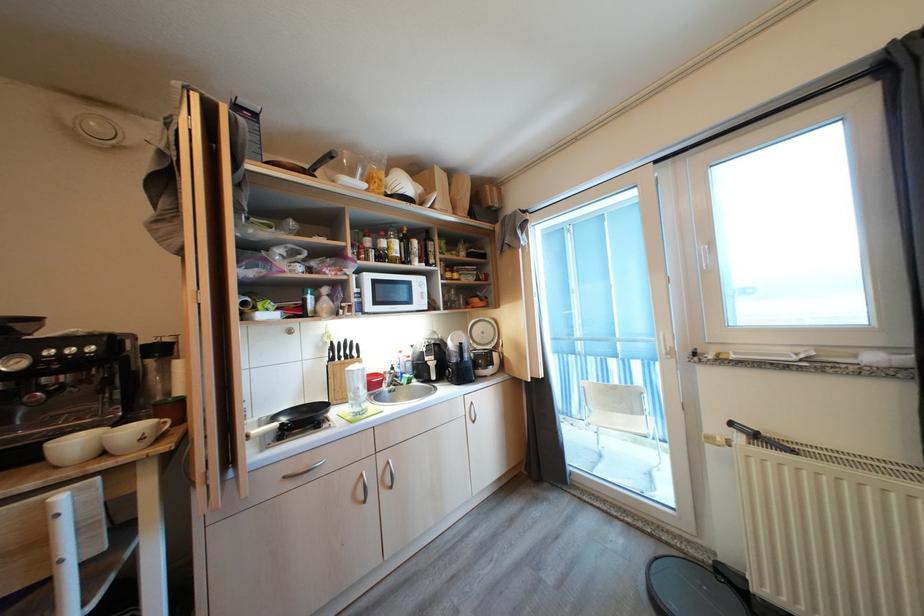
What do you see at coordinates (391, 377) in the screenshot? I see `the sink faucet handle` at bounding box center [391, 377].